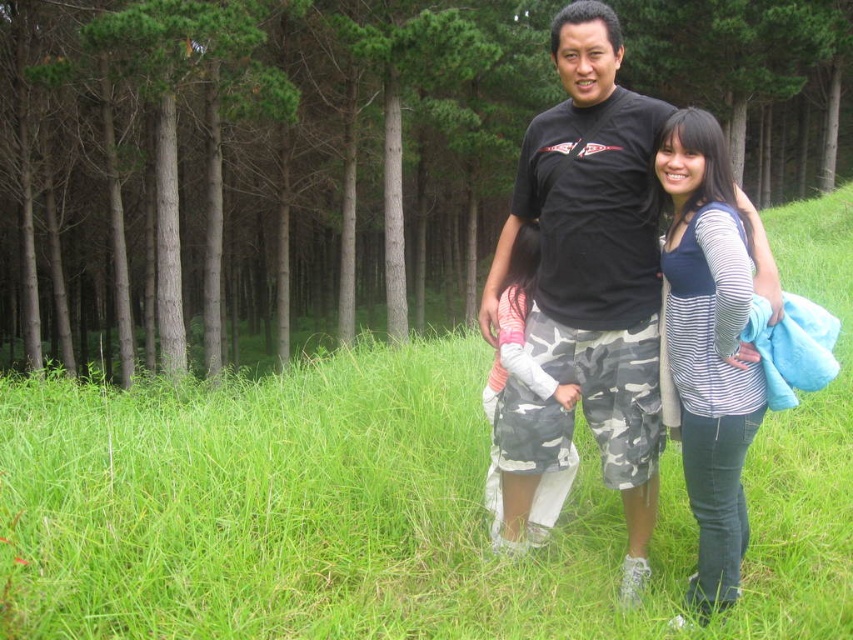
You are standing in the grassy field and want to take a photo of the green leafy tree at center. Where should you position yourself to capture it in the frame?

You should position yourself facing the green leafy tree at center located at point (251, 170) to capture it in the frame.